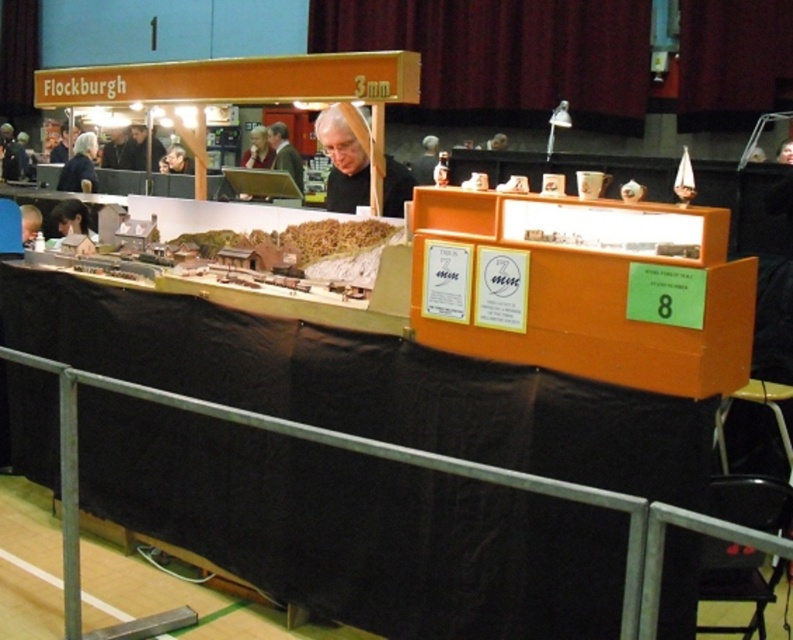
Question: Among these points, which one is farthest from the camera?

Choices:
 (A) (282, 140)
 (B) (94, 188)
 (C) (52, 209)

Answer: (A)

Question: Among these points, which one is nearest to the camera?

Choices:
 (A) (83, 225)
 (B) (282, 128)
 (C) (347, 179)

Answer: (C)

Question: Is white matte hair at center thinner than black fabric at left?

Choices:
 (A) yes
 (B) no

Answer: (A)

Question: Is white matte hair at center to the right of dark brown leather jacket at center from the viewer's perspective?

Choices:
 (A) yes
 (B) no

Answer: (A)

Question: Which object is the farthest from the matte black hair at left?

Choices:
 (A) black fabric at left
 (B) white matte hair at center

Answer: (A)

Question: Does white matte hair at center come behind dark brown leather jacket at center?

Choices:
 (A) no
 (B) yes

Answer: (A)